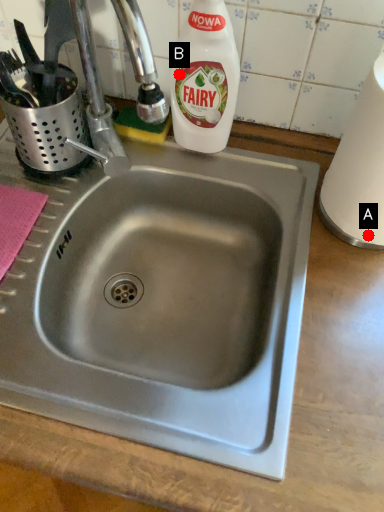
Question: Two points are circled on the image, labeled by A and B beside each circle. Which point is farther to the camera?

Choices:
 (A) A is further
 (B) B is further

Answer: (B)